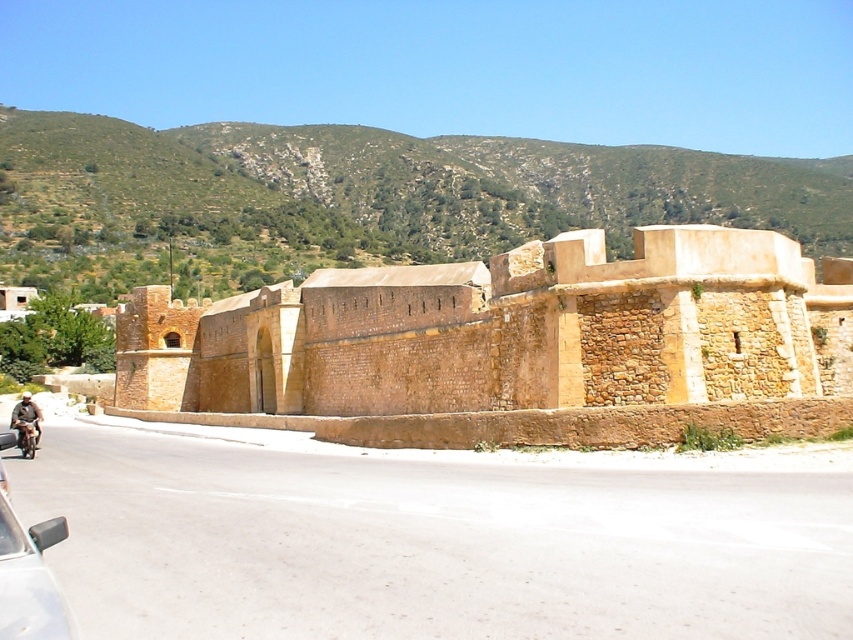
You are standing on the paved road near the brown stone wall at center and the green textured hillside at upper center. Which object is closer to you?

The brown stone wall at center is closer to you since it is positioned in front of the green textured hillside at upper center.

You are standing at the entrance of the road near the brown stone wall at center. If you walk straight ahead, will you eventually see the wall on your left or right side?

Since the brown stone wall at center is located at coordinates point (514, 346), walking straight ahead along the road would keep the wall in the center of your view, so it won